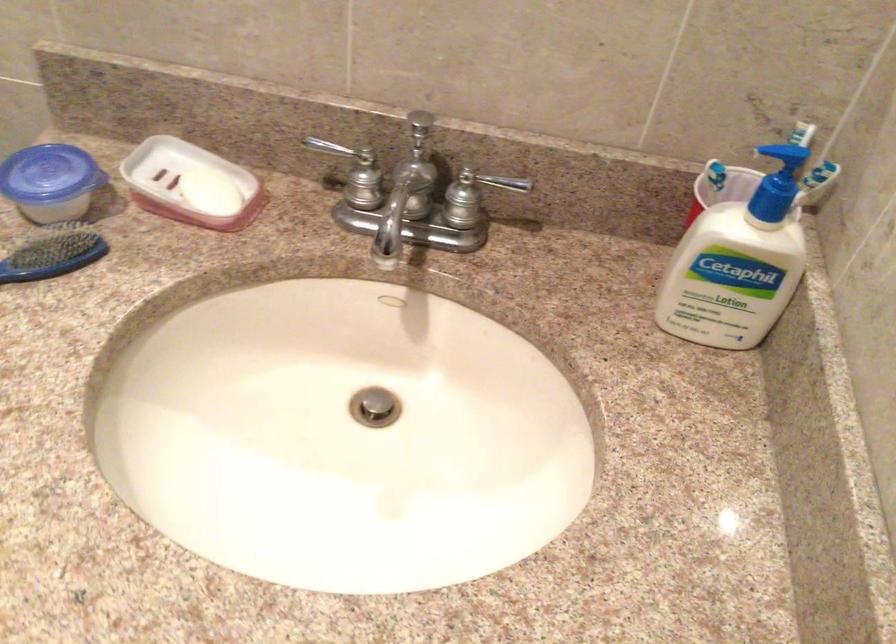
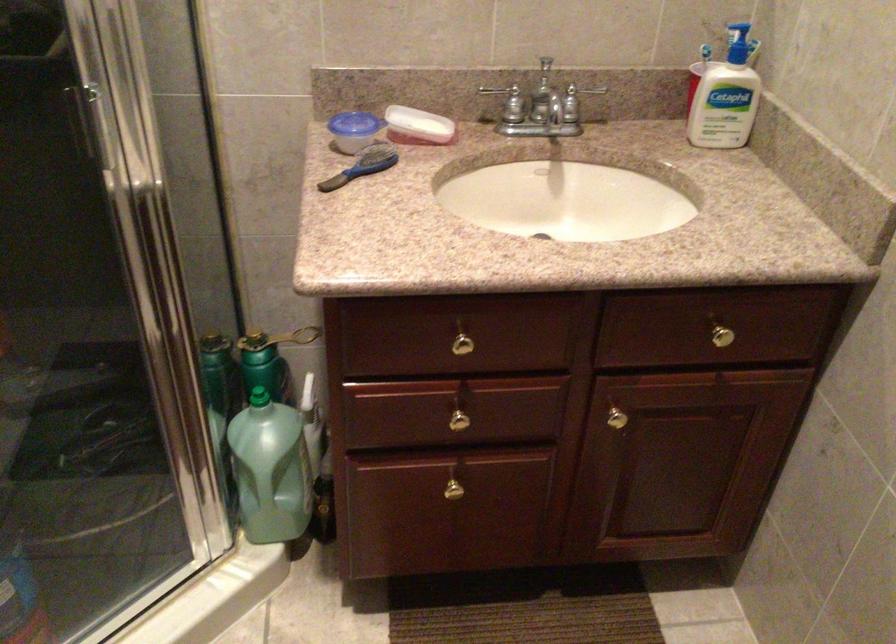
Where in the second image is the point corresponding to point (469, 204) from the first image?

(574, 105)